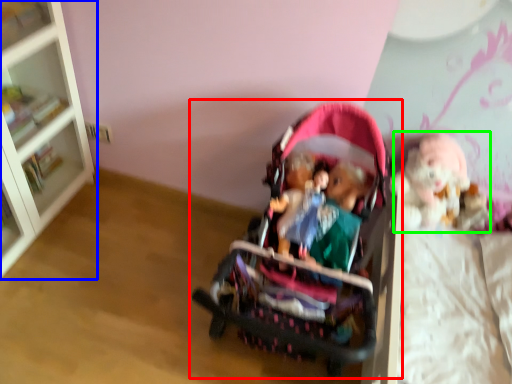
Question: Based on their relative distances, which object is nearer to toy (highlighted by a red box)? Choose from bookcase (highlighted by a blue box) and doll (highlighted by a green box).

Choices:
 (A) bookcase
 (B) doll

Answer: (B)